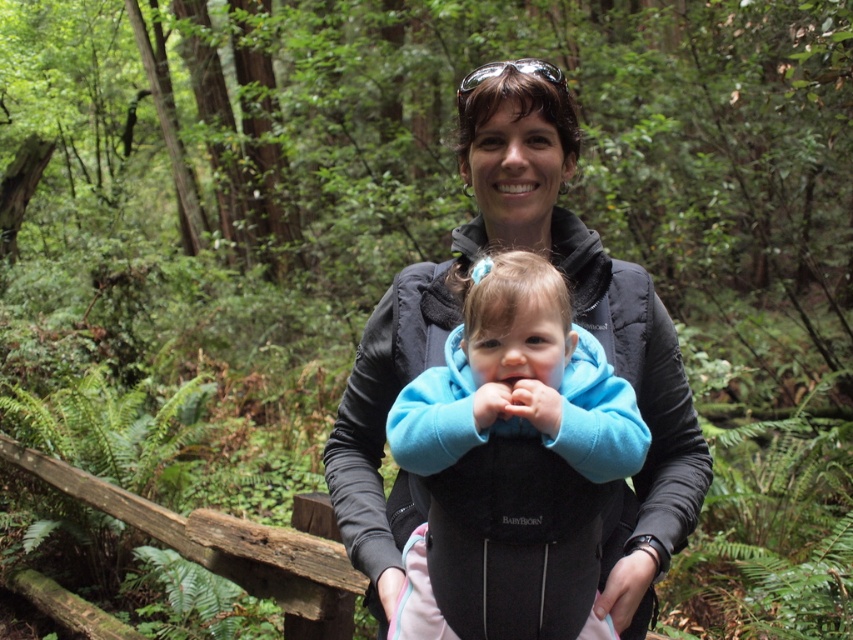
Question: Which object appears farthest from the camera in this image?

Choices:
 (A) black softshell jacket at center
 (B) blue fleece baby at center

Answer: (A)

Question: Which point appears closest to the camera in this image?

Choices:
 (A) (538, 380)
 (B) (541, 122)

Answer: (A)

Question: Which of the following is the farthest from the observer?

Choices:
 (A) (489, 410)
 (B) (491, 80)

Answer: (B)

Question: In this image, where is black softshell jacket at center located relative to blue fleece baby at center?

Choices:
 (A) right
 (B) left

Answer: (B)

Question: Can you confirm if black softshell jacket at center is positioned to the right of blue fleece baby at center?

Choices:
 (A) yes
 (B) no

Answer: (B)

Question: From the image, what is the correct spatial relationship of black softshell jacket at center in relation to blue fleece baby at center?

Choices:
 (A) below
 (B) above

Answer: (B)